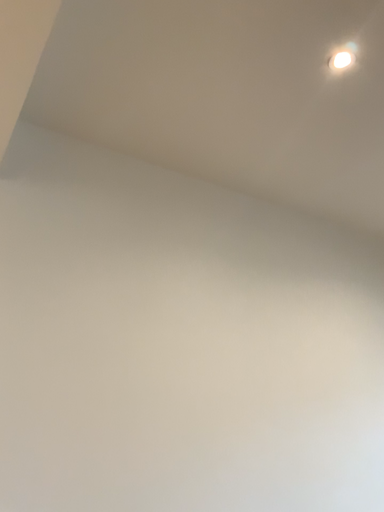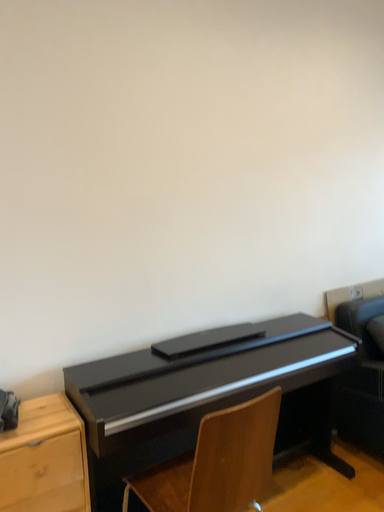
Question: Which way did the camera rotate in the video?

Choices:
 (A) rotated downward
 (B) rotated upward

Answer: (A)